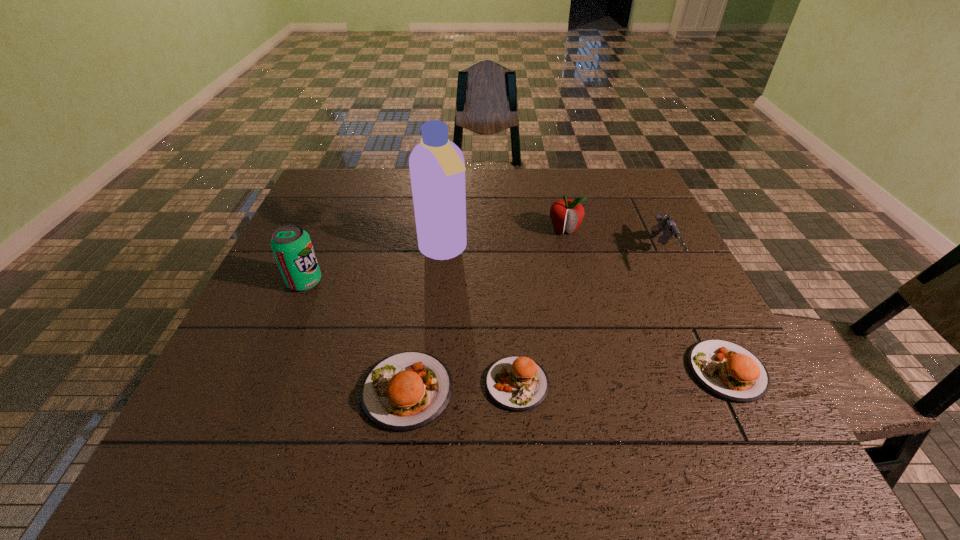
Image resolution: width=960 pixels, height=540 pixels. I want to click on the leftmost patty, so click(x=406, y=391).

Where is `the second patty from left to right`? the second patty from left to right is located at coordinates (516, 383).

You are a GUI agent. You are given a task and a screenshot of the screen. Output one action in this format:
    pyautogui.click(x=<x>, y=<y>)
    Task: Click on the shortest object
    
    Given the screenshot: What is the action you would take?
    pyautogui.click(x=516, y=383)

Image resolution: width=960 pixels, height=540 pixels. I want to click on the second tallest patty, so click(728, 370).

I want to click on the rightmost patty, so click(x=728, y=370).

You are a GUI agent. You are given a task and a screenshot of the screen. Output one action in this format:
    pyautogui.click(x=<x>, y=<y>)
    Task: Click on the third object from right to left
    The width and height of the screenshot is (960, 540).
    Given the screenshot: What is the action you would take?
    pyautogui.click(x=566, y=214)

Find the location of a particular element. The image size is (960, 540). the tallest object is located at coordinates (437, 168).

Where is `gun`? gun is located at coordinates (666, 224).

The height and width of the screenshot is (540, 960). I want to click on the sixth shortest object, so click(292, 247).

You are a GUI agent. You are given a task and a screenshot of the screen. Output one action in this format:
    pyautogui.click(x=<x>, y=<y>)
    Task: Click on the leftmost object
    The width and height of the screenshot is (960, 540).
    Given the screenshot: What is the action you would take?
    pyautogui.click(x=292, y=247)